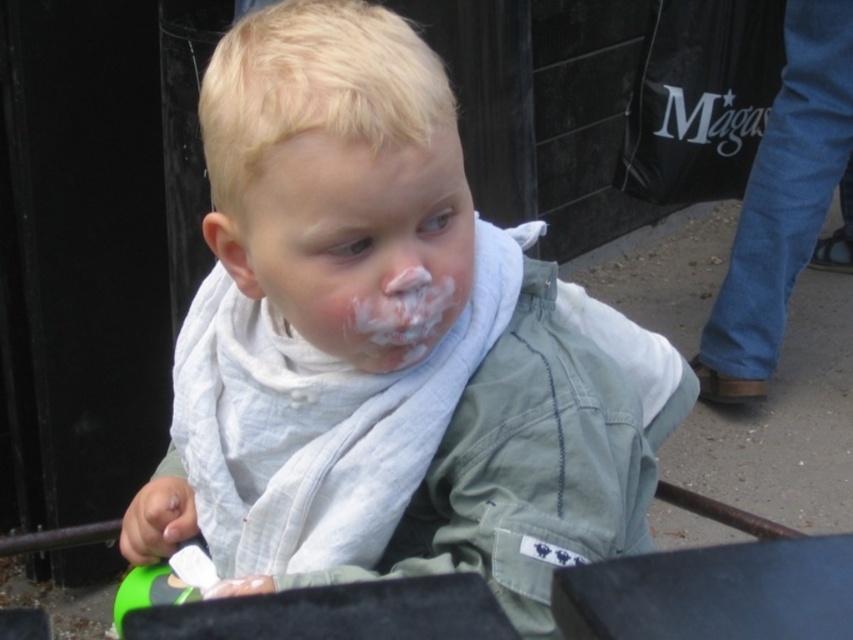
Does light green fabric shirt at center have a greater height compared to white matte scarf at center?

Indeed, light green fabric shirt at center has a greater height compared to white matte scarf at center.

Is point (537, 304) positioned behind point (339, 298)?

That is True.

You are a GUI agent. You are given a task and a screenshot of the screen. Output one action in this format:
    pyautogui.click(x=<x>, y=<y>)
    Task: Click on the light green fabric shirt at center
    Image resolution: width=853 pixels, height=640 pixels.
    Given the screenshot: What is the action you would take?
    pyautogui.click(x=387, y=353)

Is white matte scarf at center below white creamy frosting at center?

Incorrect, white matte scarf at center is not positioned below white creamy frosting at center.

Who is more forward, (422, 145) or (402, 340)?

Point (422, 145) is in front.

Find the location of a particular element. This screenshot has width=853, height=640. white matte scarf at center is located at coordinates (357, 243).

Can you confirm if light green fabric shirt at center is wider than white creamy frosting at center?

Yes.

What are the coordinates of `light green fabric shirt at center` in the screenshot? It's located at (387, 353).